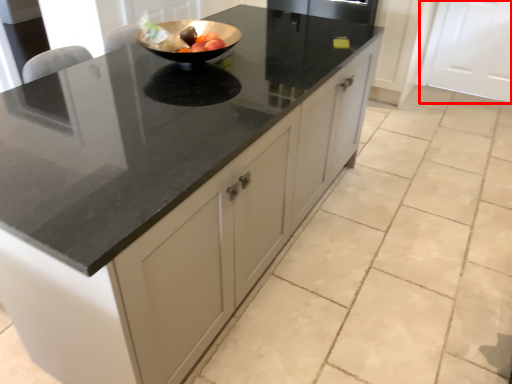
Question: Observing the image, what is the correct spatial positioning of cabinetry (annotated by the red box) in reference to fruit?

Choices:
 (A) right
 (B) left

Answer: (A)